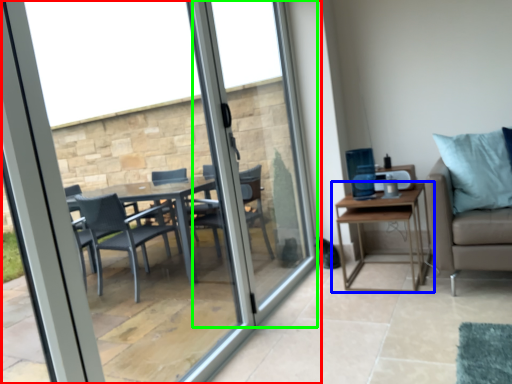
Question: Which object is the farthest from window (highlighted by a red box)? Choose among these: table (highlighted by a blue box) or screen door (highlighted by a green box).

Choices:
 (A) table
 (B) screen door

Answer: (A)